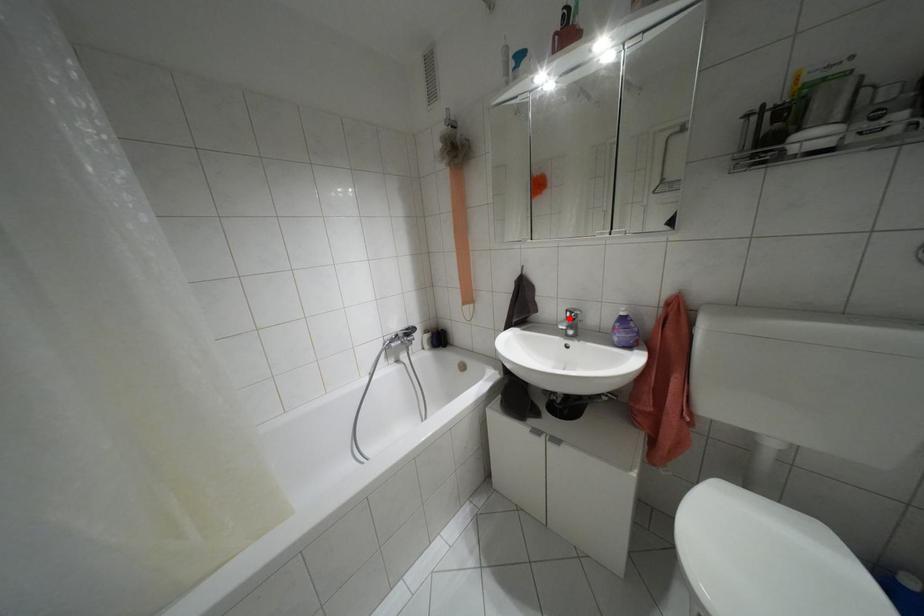
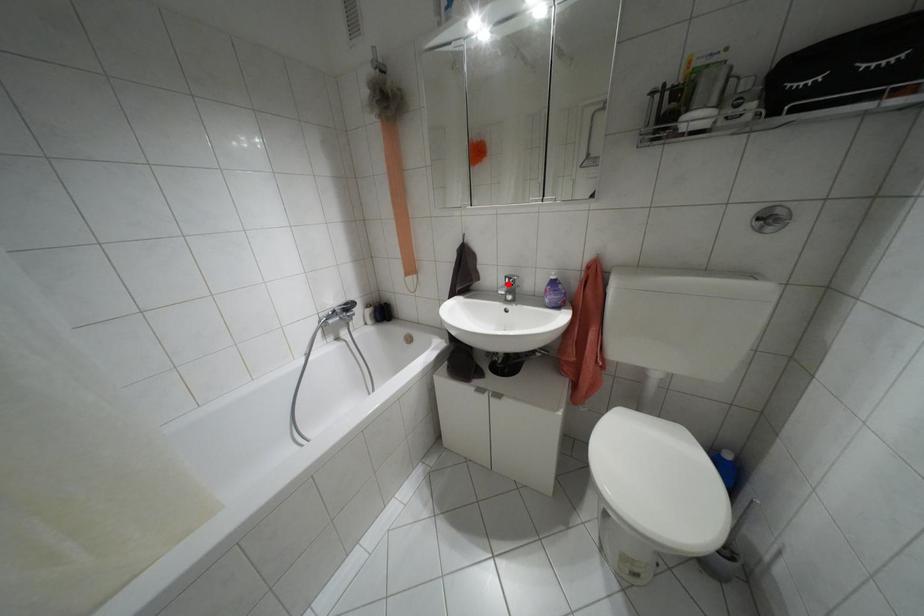
I am providing you with two images of the same scene from different viewpoints. A red point is marked on the first image and another point is marked on the second image. Are the points marked in image1 and image2 representing the same 3D position?

Yes